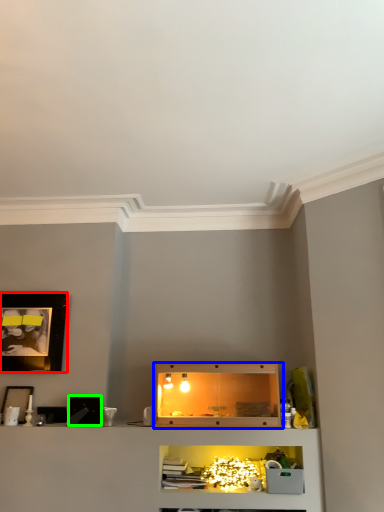
Question: Which object is the farthest from picture frame (highlighted by a red box)? Choose among these: shelf (highlighted by a blue box) or picture frame (highlighted by a green box).

Choices:
 (A) shelf
 (B) picture frame

Answer: (A)